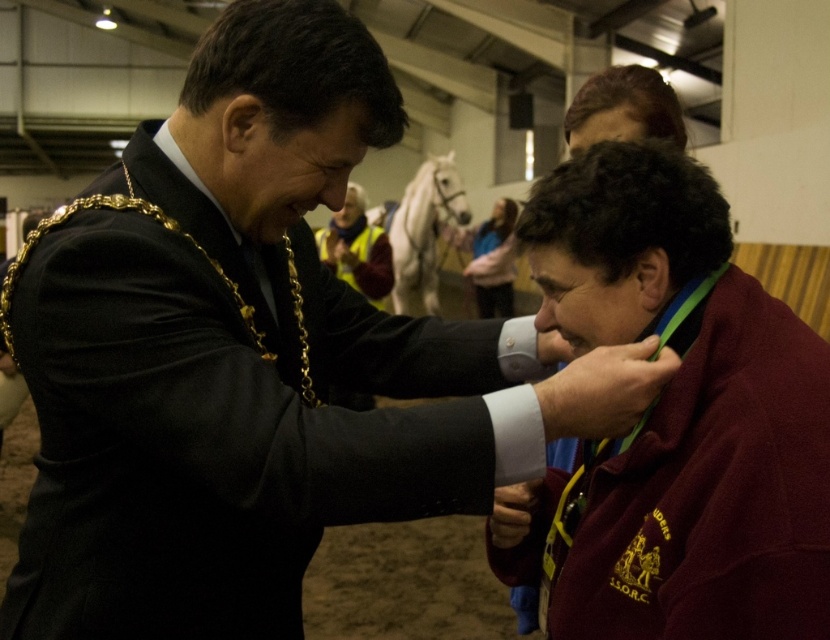
Between point (210, 468) and point (579, 284), which one is positioned behind?

The point (579, 284) is behind.

Is point (332, 488) positioned after point (653, 592)?

No.

The image size is (830, 640). I want to click on maroon jersey at center, so click(x=227, y=417).